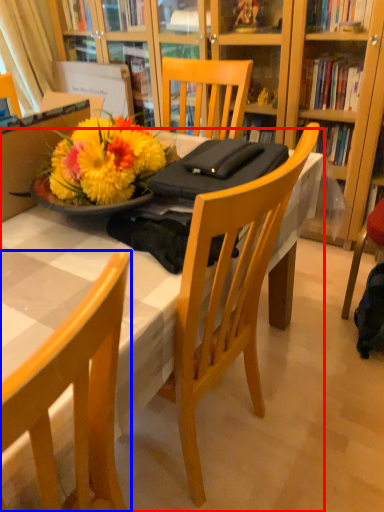
Question: Which object appears farthest to the camera in this image, desk (highlighted by a red box) or chair (highlighted by a blue box)?

Choices:
 (A) desk
 (B) chair

Answer: (A)